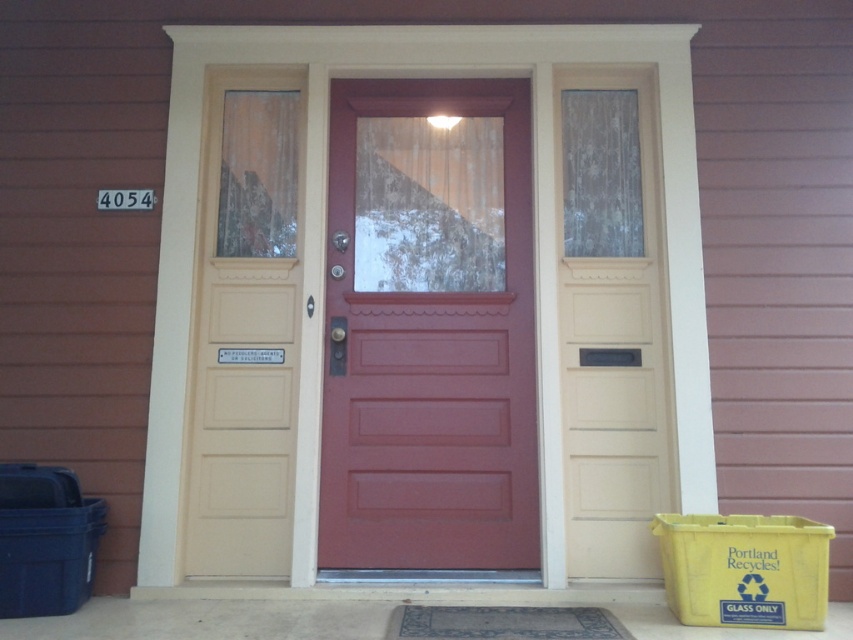
Question: Can you confirm if matte cream door at center is wider than blue woven mat at center?

Choices:
 (A) yes
 (B) no

Answer: (B)

Question: Based on their relative distances, which object is nearer to the blue woven mat at center?

Choices:
 (A) matte red door at center
 (B) matte cream door at center

Answer: (A)

Question: Is the position of matte red door at center less distant than that of blue woven mat at center?

Choices:
 (A) yes
 (B) no

Answer: (B)

Question: Which object is closer to the camera taking this photo?

Choices:
 (A) matte red door at center
 (B) blue woven mat at center

Answer: (B)

Question: Estimate the real-world distances between objects in this image. Which object is farther from the matte red door at center?

Choices:
 (A) blue woven mat at center
 (B) matte cream door at center

Answer: (A)

Question: Does matte cream door at center have a smaller size compared to blue woven mat at center?

Choices:
 (A) yes
 (B) no

Answer: (B)